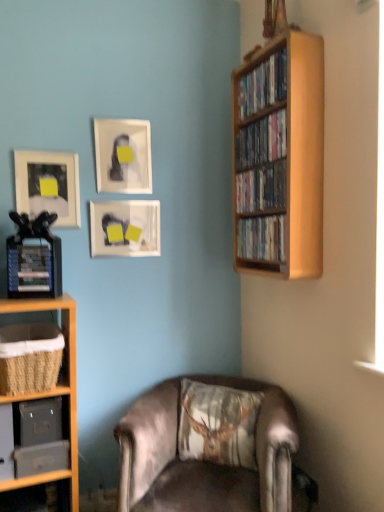
The width and height of the screenshot is (384, 512). What do you see at coordinates (62, 329) in the screenshot?
I see `woven brown basket at lower left, which appears as the 1th shelf when viewed from the top` at bounding box center [62, 329].

In order to face matte black picture frame at upper left, which is the 1th picture frame from left to right, should I rotate leftwards or rightwards?

You should look left and rotate roughly 18.684 degrees.

What is the approximate width of wooden shelf at upper right, which is the 4th book in top-to-bottom order?

wooden shelf at upper right, which is the 4th book in top-to-bottom order, is 7.75 inches in width.

In order to face matte glass picture frame at upper center, arranged as the second picture frame when viewed from the left, should I rotate leftwards or rightwards?

Turn left by 9.132 degrees to look at matte glass picture frame at upper center, arranged as the second picture frame when viewed from the left.

The image size is (384, 512). I want to click on matte glass picture frame at upper center, arranged as the second picture frame when viewed from the left, so click(123, 155).

The image size is (384, 512). I want to click on wooden shelf at upper right, which is the 3th book from bottom to top, so click(261, 141).

Where is `woven brown basket at lower left, placed as the second shelf when sorted from bottom to top`? Image resolution: width=384 pixels, height=512 pixels. woven brown basket at lower left, placed as the second shelf when sorted from bottom to top is located at coordinates (62, 329).

What's the angular difference between velvet brown chair at lower center and wooden shelf at upper right, the 2th book ordered from the bottom,'s facing directions?

velvet brown chair at lower center and wooden shelf at upper right, the 2th book ordered from the bottom, are facing 57.4 degrees away from each other.

Does velvet brown chair at lower center turn towards wooden shelf at upper right, which is the third book in top-to-bottom order?

No, velvet brown chair at lower center is not turned towards wooden shelf at upper right, which is the third book in top-to-bottom order.

This screenshot has height=512, width=384. I want to click on chair lying on the left of wooden shelf at upper right, which is the third book in top-to-bottom order, so click(x=201, y=461).

Considering the sizes of objects velvet brown chair at lower center and wooden shelf at upper right, the 2th book ordered from the bottom, in the image provided, who is bigger, velvet brown chair at lower center or wooden shelf at upper right, the 2th book ordered from the bottom,?

velvet brown chair at lower center is bigger.

Does matte glass picture frame at upper center, acting as the 2th picture frame starting from the right, turn towards printed fabric cushion at lower center?

No, matte glass picture frame at upper center, acting as the 2th picture frame starting from the right, is not facing towards printed fabric cushion at lower center.

From the image's perspective, which one is positioned lower, matte glass picture frame at upper center, arranged as the second picture frame when viewed from the left, or printed fabric cushion at lower center?

printed fabric cushion at lower center.

Is matte glass picture frame at upper center, acting as the 2th picture frame starting from the right, taller or shorter than printed fabric cushion at lower center?

Clearly, matte glass picture frame at upper center, acting as the 2th picture frame starting from the right, is shorter compared to printed fabric cushion at lower center.

Is there a large distance between matte glass picture frame at upper center, acting as the 2th picture frame starting from the right, and printed fabric cushion at lower center?

Absolutely, matte glass picture frame at upper center, acting as the 2th picture frame starting from the right, is distant from printed fabric cushion at lower center.

From the picture: Based on their sizes in the image, would you say hardcover book at left is bigger or smaller than wooden shelf at upper right, marked as the first book in a top-to-bottom arrangement?

Considering their sizes, hardcover book at left takes up less space than wooden shelf at upper right, marked as the first book in a top-to-bottom arrangement.

Considering the sizes of hardcover book at left and wooden shelf at upper right, which appears as the fourth book when ordered from the bottom, in the image, is hardcover book at left wider or thinner than wooden shelf at upper right, which appears as the fourth book when ordered from the bottom,?

Considering their sizes, hardcover book at left looks slimmer than wooden shelf at upper right, which appears as the fourth book when ordered from the bottom.

Between hardcover book at left and wooden shelf at upper right, which appears as the fourth book when ordered from the bottom, which one has more height?

wooden shelf at upper right, which appears as the fourth book when ordered from the bottom.

Which is behind, point (63, 307) or point (30, 245)?

Positioned behind is point (30, 245).

Is woven brown basket at lower left, which appears as the 1th shelf when viewed from the top, further to the viewer compared to hardcover book at left?

No, the depth of woven brown basket at lower left, which appears as the 1th shelf when viewed from the top, is less than that of hardcover book at left.

Is woven brown basket at lower left, which appears as the 1th shelf when viewed from the top, next to hardcover book at left and touching it?

No, woven brown basket at lower left, which appears as the 1th shelf when viewed from the top, is not touching hardcover book at left.

From the image's perspective, which one is positioned higher, woven brown basket at lower left, placed as the second shelf when sorted from bottom to top, or hardcover book at left?

hardcover book at left.

From a real-world perspective, who is located lower, wooden shelf at lower left, the 2th shelf in the top-to-bottom sequence, or matte glass picture frame at center, the first picture frame when ordered from right to left?

wooden shelf at lower left, the 2th shelf in the top-to-bottom sequence, from a real-world perspective.

The width and height of the screenshot is (384, 512). Identify the location of the 1st picture frame above the wooden shelf at lower left, the 2th shelf in the top-to-bottom sequence (from the image's perspective). (125, 228).

From the image's perspective, is wooden shelf at lower left, the first shelf when ordered from bottom to top, on top of matte glass picture frame at center, arranged as the 3th picture frame when viewed from the left?

No, from the image's perspective, wooden shelf at lower left, the first shelf when ordered from bottom to top, is not on top of matte glass picture frame at center, arranged as the 3th picture frame when viewed from the left.

Looking at this image, which of these two, wooden shelf at lower left, the first shelf when ordered from bottom to top, or matte glass picture frame at center, the first picture frame when ordered from right to left, stands taller?

matte glass picture frame at center, the first picture frame when ordered from right to left, is taller.

Is woven brown basket at lower left, which appears as the 1th shelf when viewed from the top, in contact with wooden shelf at upper right, placed as the second book when sorted from top to bottom?

woven brown basket at lower left, which appears as the 1th shelf when viewed from the top, and wooden shelf at upper right, placed as the second book when sorted from top to bottom, are clearly separated.

Based on the photo, is woven brown basket at lower left, placed as the second shelf when sorted from bottom to top, oriented towards wooden shelf at upper right, placed as the second book when sorted from top to bottom?

No, woven brown basket at lower left, placed as the second shelf when sorted from bottom to top, is not turned towards wooden shelf at upper right, placed as the second book when sorted from top to bottom.

Based on the photo, from a real-world perspective, is woven brown basket at lower left, placed as the second shelf when sorted from bottom to top, physically located above or below wooden shelf at upper right, which is the 3th book from bottom to top?

Clearly, from a real-world perspective, woven brown basket at lower left, placed as the second shelf when sorted from bottom to top, is below wooden shelf at upper right, which is the 3th book from bottom to top.

How different are the orientations of woven brown basket at lower left, placed as the second shelf when sorted from bottom to top, and wooden shelf at upper right, which is the 3th book from bottom to top, in degrees?

93.8 degrees separate the facing orientations of woven brown basket at lower left, placed as the second shelf when sorted from bottom to top, and wooden shelf at upper right, which is the 3th book from bottom to top.

Is wooden shelf at upper right, marked as the first book in a top-to-bottom arrangement, turned away from velvet brown chair at lower center?

No, wooden shelf at upper right, marked as the first book in a top-to-bottom arrangement,'s orientation is not away from velvet brown chair at lower center.

From the picture: Who is bigger, wooden shelf at upper right, marked as the first book in a top-to-bottom arrangement, or velvet brown chair at lower center?

Bigger between the two is velvet brown chair at lower center.

Is point (270, 81) closer or farther from the camera than point (287, 408)?

Point (270, 81) appears to be farther away from the viewer than point (287, 408).

From a real-world perspective, count 2nd books upward from the velvet brown chair at lower center and point to it. Please provide its 2D coordinates.

[(261, 188)]

Image resolution: width=384 pixels, height=512 pixels. Find the location of `the 2nd picture frame counting from the left of the printed fabric cushion at lower center`. the 2nd picture frame counting from the left of the printed fabric cushion at lower center is located at coordinates (123, 155).

When comparing their distances from wooden shelf at lower left, the first shelf when ordered from bottom to top, does wooden bookshelf at right or wooden shelf at upper right, which is the 4th book in top-to-bottom order, seem closer?

Among the two, wooden shelf at upper right, which is the 4th book in top-to-bottom order, is located nearer to wooden shelf at lower left, the first shelf when ordered from bottom to top.

Looking at the image, which one is located closer to wooden shelf at upper right, placed as the second book when sorted from top to bottom, wooden shelf at upper right, placed as the first book when sorted from bottom to top, or wooden shelf at upper right, which appears as the fourth book when ordered from the bottom?

wooden shelf at upper right, which appears as the fourth book when ordered from the bottom, is closer to wooden shelf at upper right, placed as the second book when sorted from top to bottom.

Based on their spatial positions, is wooden shelf at upper right, placed as the first book when sorted from bottom to top, or matte black picture frame at upper left, which is the 1th picture frame from left to right, further from wooden shelf at upper right, the 2th book ordered from the bottom?

matte black picture frame at upper left, which is the 1th picture frame from left to right, lies further to wooden shelf at upper right, the 2th book ordered from the bottom, than the other object.

Looking at the image, which one is located further to wooden shelf at lower left, the 2th shelf in the top-to-bottom sequence, wooden shelf at upper right, which appears as the fourth book when ordered from the bottom, or wooden bookshelf at right?

wooden shelf at upper right, which appears as the fourth book when ordered from the bottom, is positioned further to the anchor wooden shelf at lower left, the 2th shelf in the top-to-bottom sequence.

In the scene shown: From the image, which object appears to be farther from wooden shelf at upper right, which is the 4th book in top-to-bottom order, woven brown basket at lower left, which appears as the 1th shelf when viewed from the top, or wooden shelf at upper right, the 2th book ordered from the bottom?

woven brown basket at lower left, which appears as the 1th shelf when viewed from the top.

Looking at the image, which one is located further to wooden shelf at lower left, the first shelf when ordered from bottom to top, wooden bookshelf at right or hardcover book at left?

Among the two, wooden bookshelf at right is located further to wooden shelf at lower left, the first shelf when ordered from bottom to top.

Which object lies nearer to the anchor point wooden bookshelf at right, wooden shelf at upper right, placed as the first book when sorted from bottom to top, or matte black picture frame at upper left, which is the 1th picture frame from left to right?

wooden shelf at upper right, placed as the first book when sorted from bottom to top.

Based on the photo, considering their positions, is hardcover book at left positioned closer to wooden shelf at upper right, the 2th book ordered from the bottom, than matte black picture frame at upper left, which is the 1th picture frame from left to right?

Based on the image, matte black picture frame at upper left, which is the 1th picture frame from left to right, appears to be nearer to wooden shelf at upper right, the 2th book ordered from the bottom.

The image size is (384, 512). I want to click on paperback book between matte black picture frame at upper left, which is the 1th picture frame from left to right, and wooden shelf at lower left, the 2th shelf in the top-to-bottom sequence, in the vertical direction, so click(x=29, y=271).

At what (x,y) coordinates should I click in order to perform the action: click on shelf between hardcover book at left and wooden shelf at lower left, the first shelf when ordered from bottom to top, in the vertical direction. Please return your answer as a coordinate pair (x, y). This screenshot has width=384, height=512. Looking at the image, I should click on (62, 329).

Where is `paperback book between matte glass picture frame at upper center, arranged as the second picture frame when viewed from the left, and wooden shelf at lower left, the first shelf when ordered from bottom to top, vertically`? paperback book between matte glass picture frame at upper center, arranged as the second picture frame when viewed from the left, and wooden shelf at lower left, the first shelf when ordered from bottom to top, vertically is located at coordinates (29, 271).

This screenshot has height=512, width=384. I want to click on paperback book that lies between wooden shelf at upper right, which is the third book in top-to-bottom order, and velvet brown chair at lower center from top to bottom, so click(x=29, y=271).